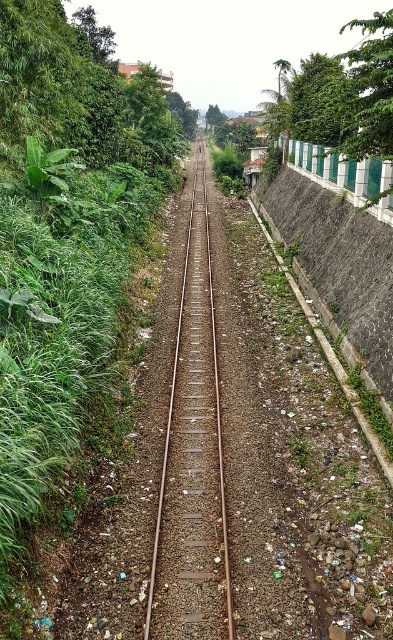
You are a maintenance worker inspecting the railway. You notice the green leafy vegetation at center and the rusty metal train track at center. Which object is positioned higher relative to the other?

The green leafy vegetation at center is above the rusty metal train track at center, so it is positioned higher.

You are standing at the point marked by the coordinates point (64, 236). Looking around, you see the railway track and surrounding areas. Which direction should you walk to reach the green leafy vegetation at center?

The green leafy vegetation at center is represented by point (64, 236), so you are already at the location of the green leafy vegetation at center. You don not need to walk anywhere else.